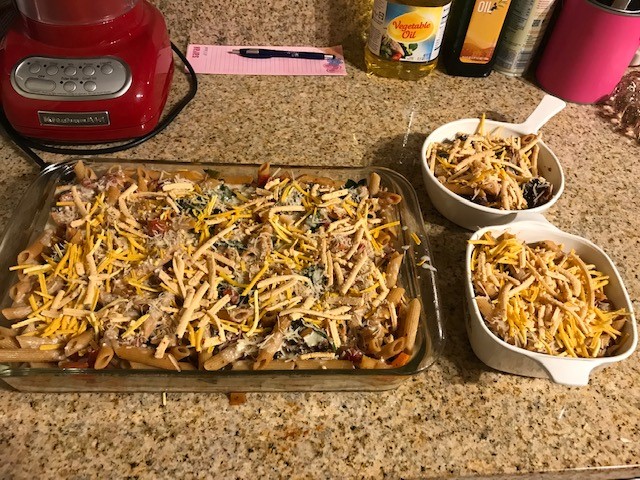
You are a GUI agent. You are given a task and a screenshot of the screen. Output one action in this format:
    pyautogui.click(x=<x>, y=<y>)
    Task: Click on the counter
    The height and width of the screenshot is (480, 640).
    Given the screenshot: What is the action you would take?
    pyautogui.click(x=339, y=438)